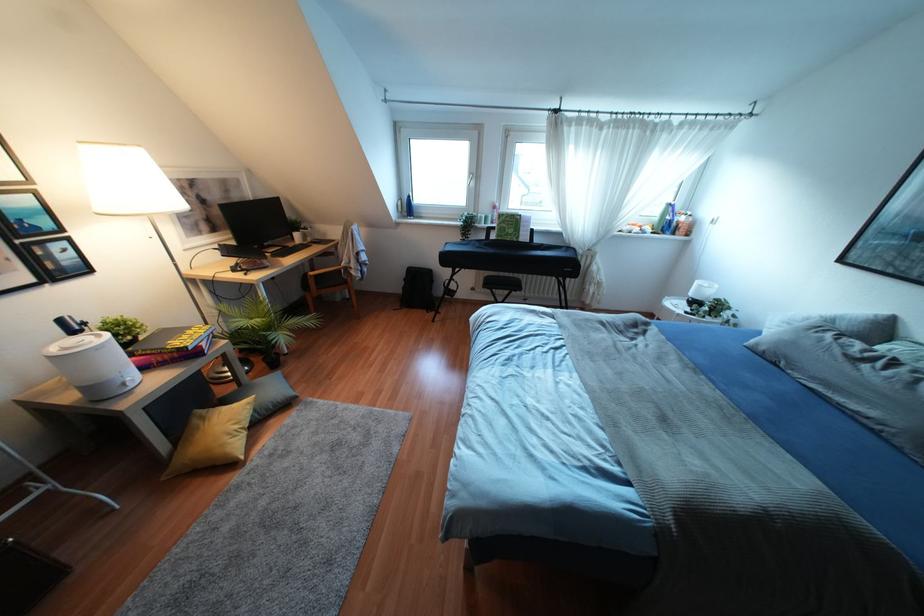
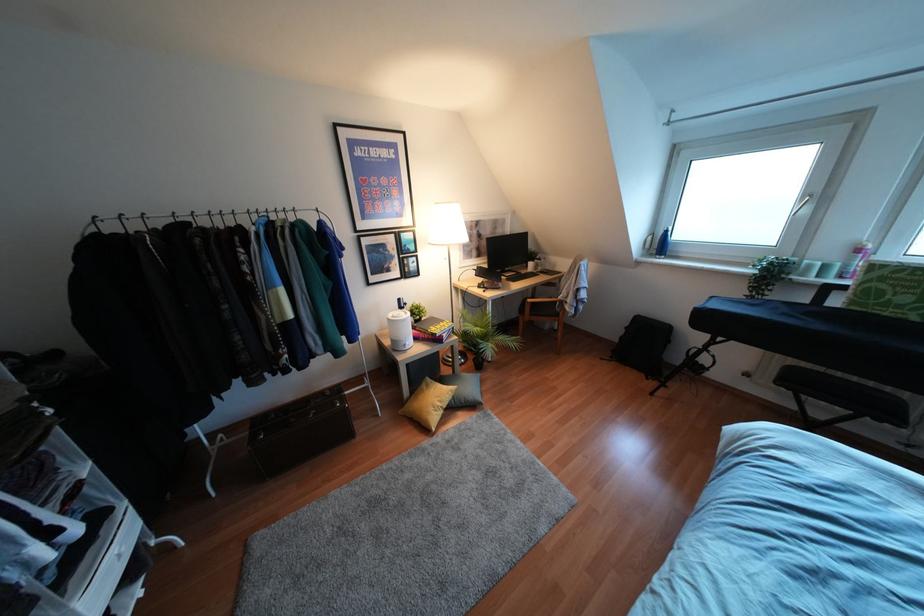
In the second image, find the point that corresponds to point 253,410 in the first image.

(453, 397)